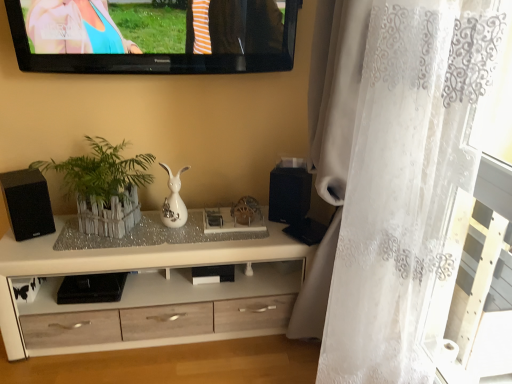
Locate an element on the screen. The height and width of the screenshot is (384, 512). free space in front of black matte speaker at left, marked as the 1th speaker in a left-to-right arrangement is located at coordinates (23, 249).